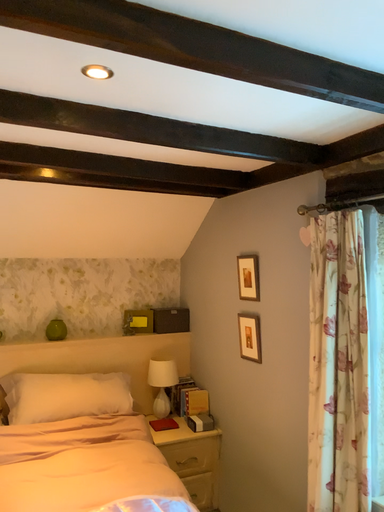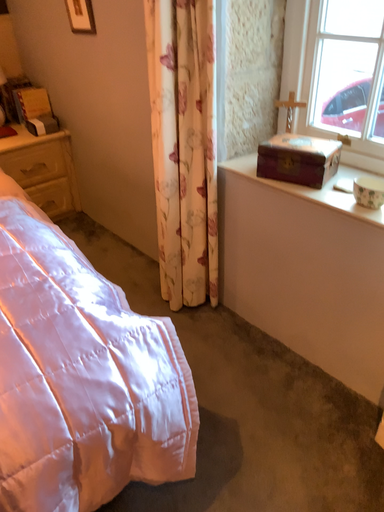
Question: How did the camera likely rotate when shooting the video?

Choices:
 (A) rotated downward
 (B) rotated upward

Answer: (A)